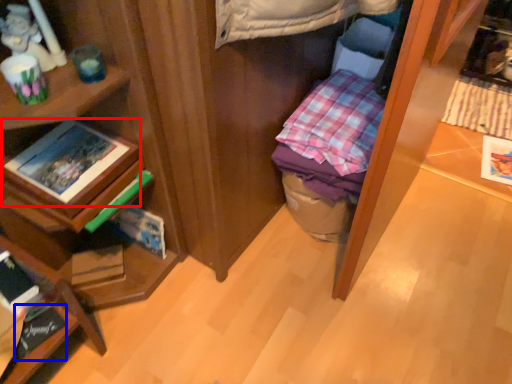
Question: Which point is further to the camera, book (highlighted by a red box) or book (highlighted by a blue box)?

Choices:
 (A) book
 (B) book

Answer: (B)